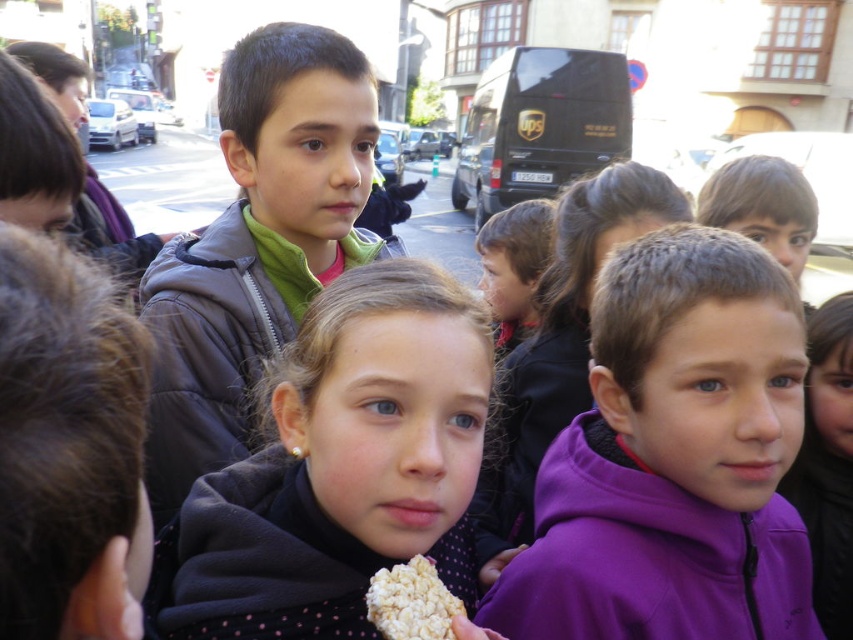
Question: Estimate the real-world distances between objects in this image. Which object is closer to the matte gray jacket at center?

Choices:
 (A) purple fleece jacket at center
 (B) dark gray fleece jacket at center
 (C) white crumbly snack at center

Answer: (B)

Question: Is purple fleece jacket at center wider than dark gray fleece jacket at center?

Choices:
 (A) yes
 (B) no

Answer: (A)

Question: Which of the following is the farthest from the observer?

Choices:
 (A) (379, 577)
 (B) (254, 292)
 (C) (618, 561)

Answer: (B)

Question: Can you confirm if dark gray fleece jacket at center is positioned above matte gray jacket at center?

Choices:
 (A) no
 (B) yes

Answer: (A)

Question: Which point is closer to the camera?

Choices:
 (A) purple fleece jacket at center
 (B) dark gray fleece jacket at center
 (C) matte gray jacket at center

Answer: (B)

Question: Is dark gray fleece jacket at center to the right of matte gray jacket at center from the viewer's perspective?

Choices:
 (A) no
 (B) yes

Answer: (B)